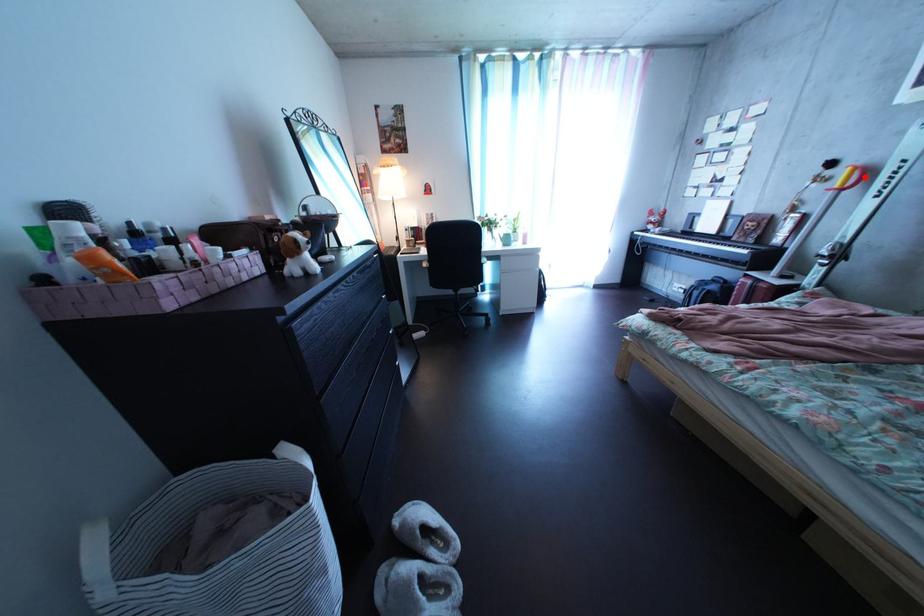
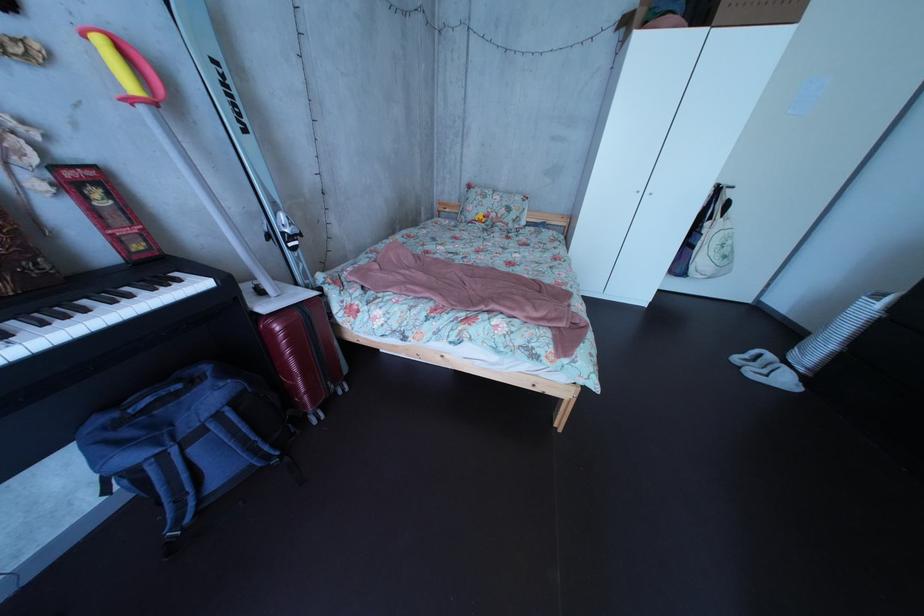
In the second image, find the point that corresponds to the highlighted location in the first image.

(116, 51)